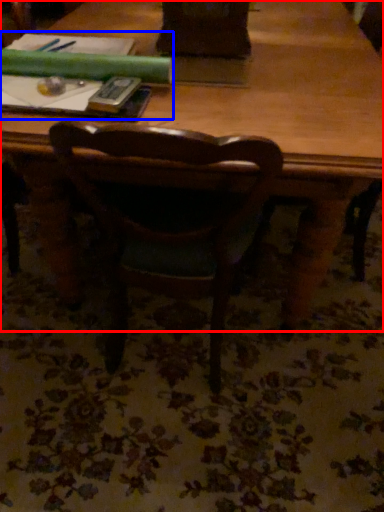
Question: Which object is further to the camera taking this photo, table (highlighted by a red box) or book (highlighted by a blue box)?

Choices:
 (A) table
 (B) book

Answer: (B)